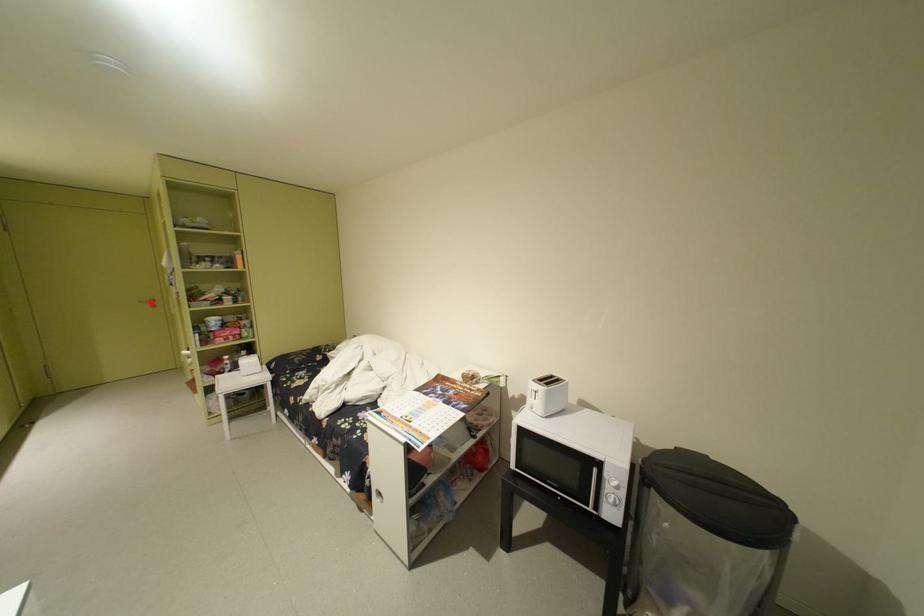
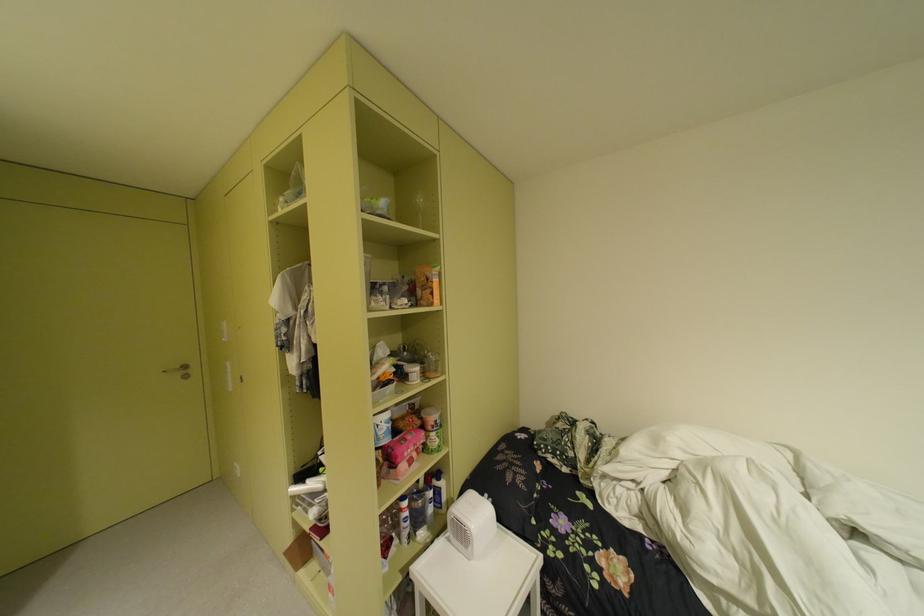
In the second image, find the point that corresponds to the highlighted location in the first image.

(175, 371)